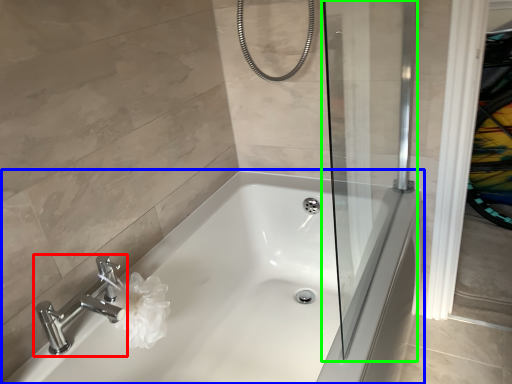
Question: Which object is the farthest from tap (highlighted by a red box)? Choose among these: bathtub (highlighted by a blue box) or screen door (highlighted by a green box).

Choices:
 (A) bathtub
 (B) screen door

Answer: (B)